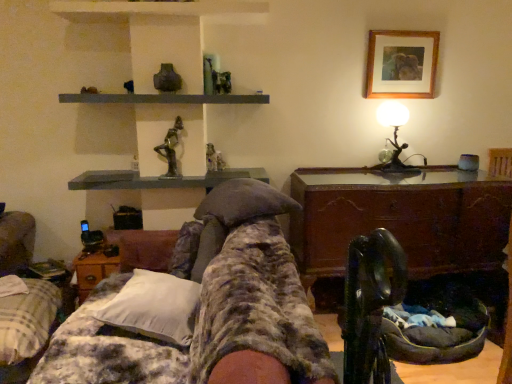
Image resolution: width=512 pixels, height=384 pixels. I want to click on free space to the left of bronze statue at upper center, so click(142, 173).